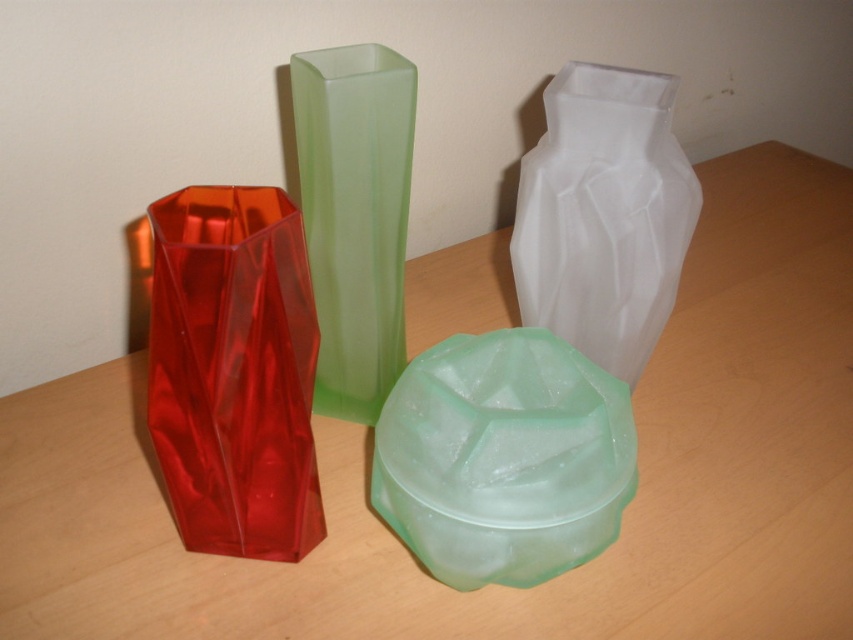
Question: Which point appears closest to the camera in this image?

Choices:
 (A) (363, 237)
 (B) (592, 246)

Answer: (A)

Question: Which of the following is the closest to the observer?

Choices:
 (A) transparent frosted vase at center
 (B) frosted green vase at center
 (C) shiny red glass vase at left
 (D) green frosted vase at center

Answer: (C)

Question: Considering the relative positions of transparent frosted vase at center and green frosted vase at center in the image provided, where is transparent frosted vase at center located with respect to green frosted vase at center?

Choices:
 (A) above
 (B) below

Answer: (A)

Question: Which of these objects is positioned closest to the green frosted vase at center?

Choices:
 (A) transparent frosted vase at center
 (B) shiny red glass vase at left

Answer: (B)

Question: Is transparent frosted vase at center to the left of green frosted vase at center from the viewer's perspective?

Choices:
 (A) yes
 (B) no

Answer: (B)

Question: Does transparent frosted vase at center lie in front of green frosted vase at center?

Choices:
 (A) no
 (B) yes

Answer: (A)